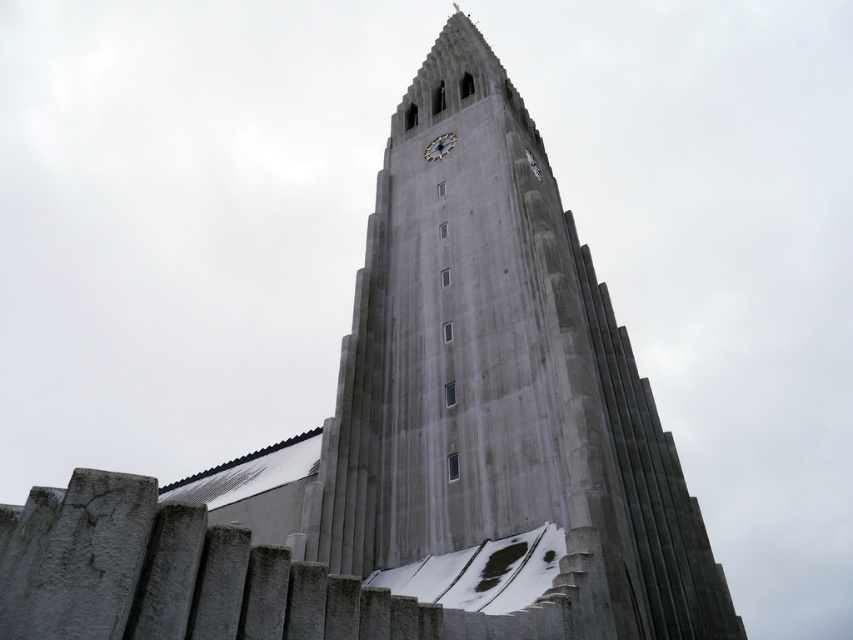
Question: Is smooth concrete fence at lower left further to the viewer compared to white textured clock at upper center?

Choices:
 (A) yes
 (B) no

Answer: (B)

Question: In this image, where is smooth concrete fence at lower left located relative to white textured clock at upper center?

Choices:
 (A) right
 (B) left

Answer: (B)

Question: Which of the following is the closest to the observer?

Choices:
 (A) (462, 634)
 (B) (444, 140)

Answer: (A)

Question: Observing the image, what is the correct spatial positioning of smooth concrete fence at lower left in reference to white textured clock at upper center?

Choices:
 (A) above
 (B) below

Answer: (B)

Question: Among these objects, which one is nearest to the camera?

Choices:
 (A) white textured clock at upper center
 (B) smooth concrete fence at lower left

Answer: (B)

Question: Among these objects, which one is nearest to the camera?

Choices:
 (A) white textured clock at upper center
 (B) smooth concrete fence at lower left

Answer: (B)